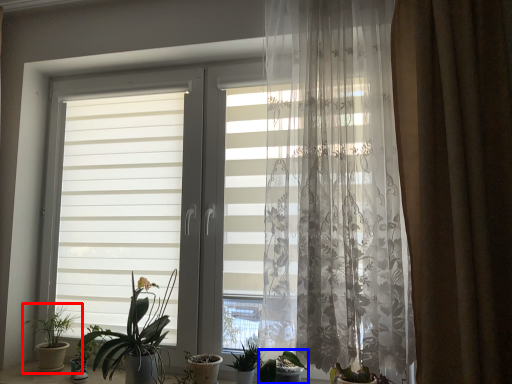
Question: Which of the following is the closest to the observer, houseplant (highlighted by a red box) or houseplant (highlighted by a blue box)?

Choices:
 (A) houseplant
 (B) houseplant

Answer: (B)